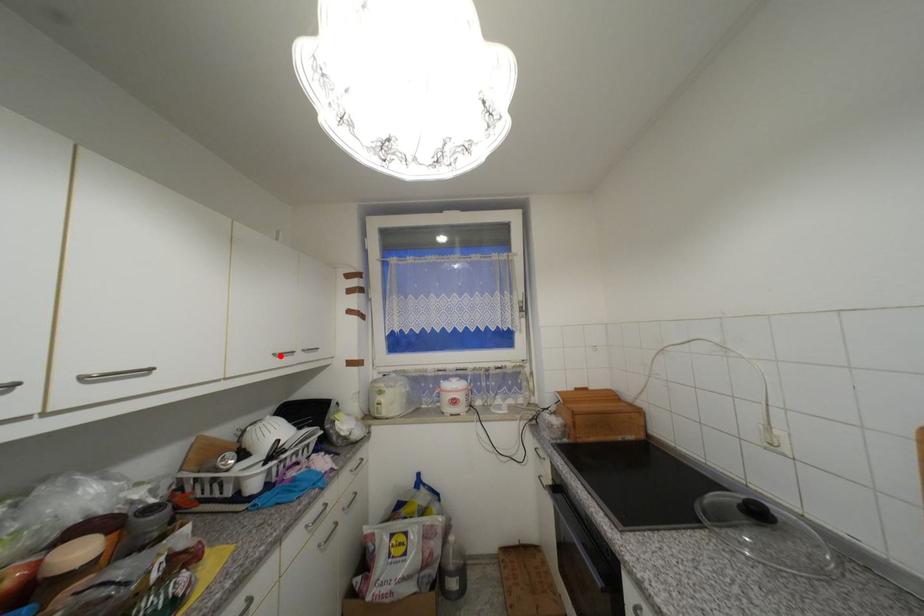
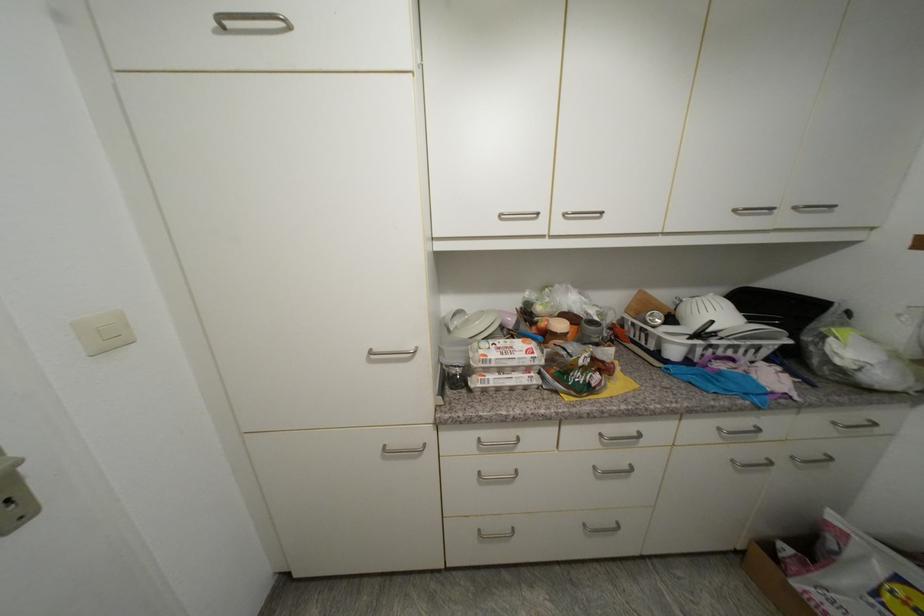
In the second image, find the point that corresponds to the highlighted location in the first image.

(740, 213)